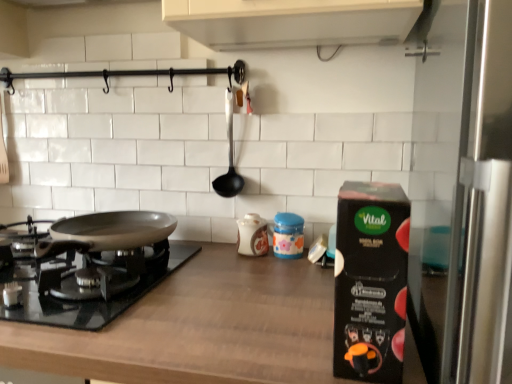
At what (x,y) coordinates should I click in order to perform the action: click on vacant space that's between black cardboard box at right, acting as the 3th kitchen appliance starting from the back, and matte ceramic jar at center, the 1th kitchen appliance in the back-to-front sequence. Please return your answer as a coordinate pair (x, y). Looking at the image, I should click on (290, 291).